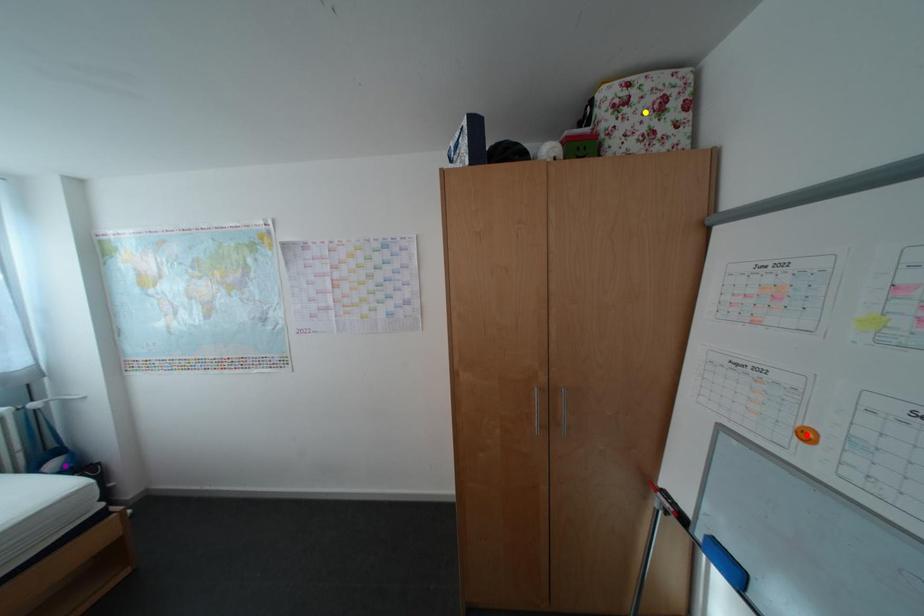
Order these from nearest to farthest:
- red point
- purple point
- yellow point

red point < yellow point < purple point